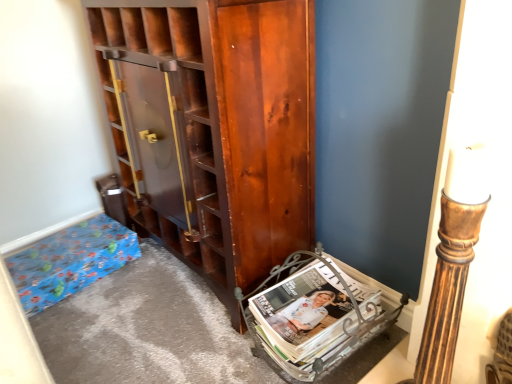
Identify the location of free space between matte metallic magazine rack at lower right and blue paper bag at lower left. The width and height of the screenshot is (512, 384). (153, 305).